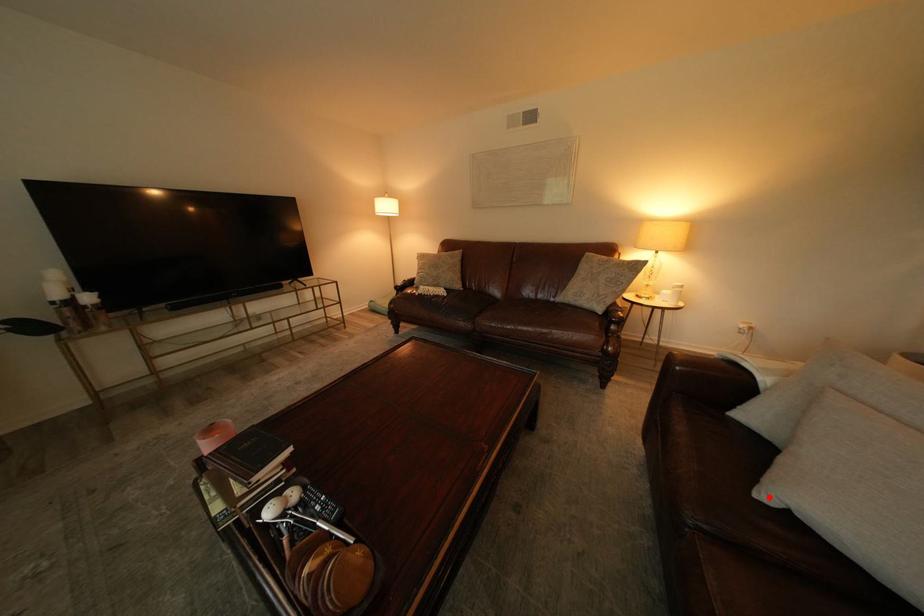
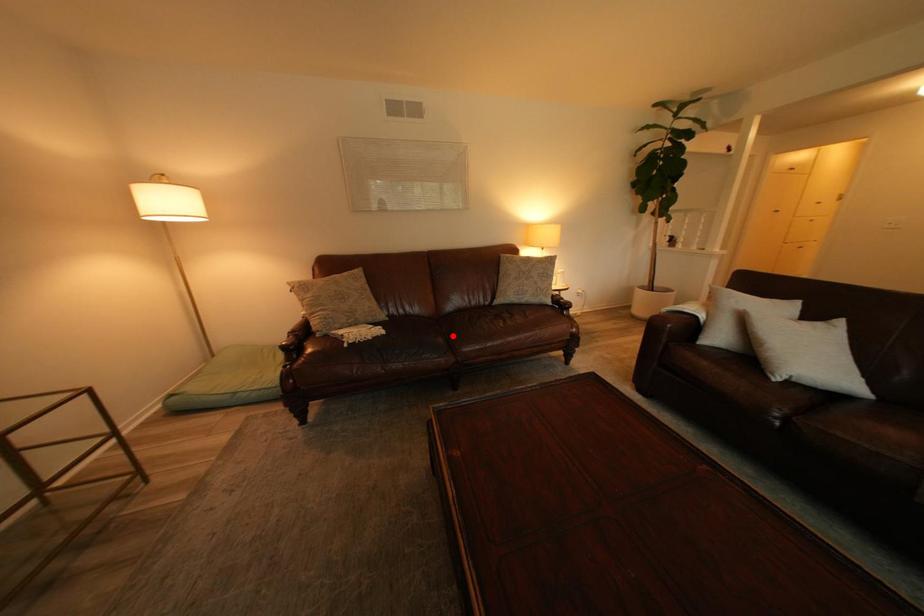
I am providing you with two images of the same scene from different viewpoints. A red point is marked on the first image and another point is marked on the second image. Does the point marked in image1 correspond to the same location as the one in image2?

No